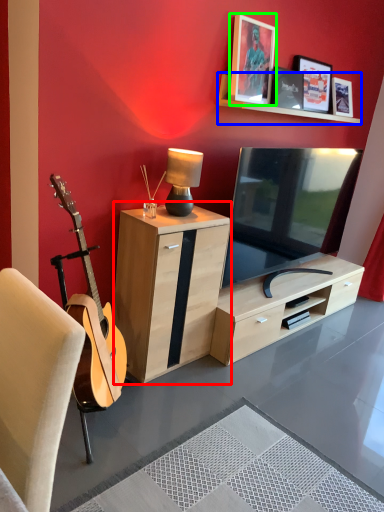
Question: Which object is the farthest from cabinetry (highlighted by a red box)? Choose among these: shelf (highlighted by a blue box) or picture frame (highlighted by a green box).

Choices:
 (A) shelf
 (B) picture frame

Answer: (A)